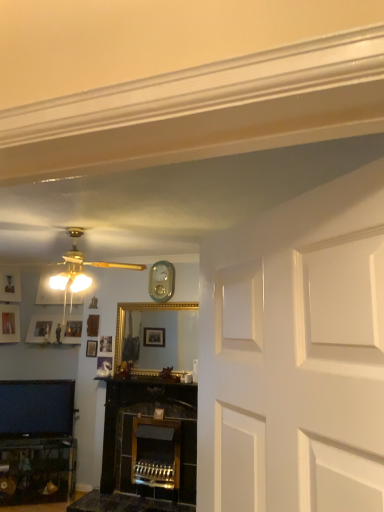
What do you see at coordinates (71, 279) in the screenshot? This screenshot has width=384, height=512. I see `matte gold ceiling fan at upper left` at bounding box center [71, 279].

Locate an element on the screen. teal glossy clock at upper center is located at coordinates (162, 281).

At what (x,y) coordinates should I click in order to perform the action: click on matte black tv at lower left. Please return your answer as a coordinate pair (x, y). Looking at the image, I should click on (36, 408).

You are a GUI agent. You are given a task and a screenshot of the screen. Output one action in this format:
    pyautogui.click(x=<x>, y=<y>)
    Task: Click on the matte gold ceiling fan at upper left
    This screenshot has height=512, width=384.
    Given the screenshot: What is the action you would take?
    pyautogui.click(x=71, y=279)

Is matte silver picture frame at upper left, which ranks as the 1th picture frame in back-to-front order, smaller than teal glossy clock at upper center?

Incorrect, matte silver picture frame at upper left, which ranks as the 1th picture frame in back-to-front order, is not smaller in size than teal glossy clock at upper center.

You are a GUI agent. You are given a task and a screenshot of the screen. Output one action in this format:
    pyautogui.click(x=<x>, y=<y>)
    Task: Click on the 2nd picture frame directly beneath the teal glossy clock at upper center (from a real-world perspective)
    This screenshot has height=512, width=384.
    Given the screenshot: What is the action you would take?
    point(40,329)

From a real-world perspective, is matte silver picture frame at upper left, which ranks as the 1th picture frame in back-to-front order, located higher than teal glossy clock at upper center?

Incorrect, from a real-world perspective, matte silver picture frame at upper left, which ranks as the 1th picture frame in back-to-front order, is lower than teal glossy clock at upper center.

The image size is (384, 512). What are the coordinates of `picture frame that is the 2nd object to the left of the matte gold ceiling fan at upper left, starting at the anchor` in the screenshot? It's located at (40, 329).

From a real-world perspective, is matte silver picture frame at upper left, acting as the second picture frame starting from the left, positioned over matte gold ceiling fan at upper left based on gravity?

Actually, matte silver picture frame at upper left, acting as the second picture frame starting from the left, is physically below matte gold ceiling fan at upper left in the real world.

Does matte silver picture frame at upper left, acting as the 2th picture frame starting from the right, have a lesser width compared to matte gold ceiling fan at upper left?

Indeed, matte silver picture frame at upper left, acting as the 2th picture frame starting from the right, has a lesser width compared to matte gold ceiling fan at upper left.

Consider the image. Between matte silver picture frame at upper left, acting as the 2th picture frame starting from the right, and matte gold ceiling fan at upper left, which one is positioned in front?

matte gold ceiling fan at upper left is in front.

Is matte silver picture frame at left, placed as the 1th picture frame when sorted from left to right, at the back of matte silver picture frame at upper left, acting as the 2th picture frame starting from the right?

matte silver picture frame at upper left, acting as the 2th picture frame starting from the right, is not turned away from matte silver picture frame at left, placed as the 1th picture frame when sorted from left to right.

How different are the orientations of matte silver picture frame at upper left, which ranks as the 1th picture frame in back-to-front order, and matte silver picture frame at left, arranged as the second picture frame when viewed from the back, in degrees?

The angular difference between matte silver picture frame at upper left, which ranks as the 1th picture frame in back-to-front order, and matte silver picture frame at left, arranged as the second picture frame when viewed from the back, is 89.6 degrees.

In the image, is matte silver picture frame at upper left, the third picture frame from the front, positioned in front of or behind matte silver picture frame at left, the 3th picture frame positioned from the right?

matte silver picture frame at upper left, the third picture frame from the front, is positioned farther from the viewer than matte silver picture frame at left, the 3th picture frame positioned from the right.

Is teal glossy clock at upper center further to the viewer compared to matte black tv at lower left?

Yes, it is.

Locate an element on the screen. The height and width of the screenshot is (512, 384). clock above the matte black tv at lower left (from a real-world perspective) is located at coordinates (162, 281).

Is teal glossy clock at upper center thinner than matte black tv at lower left?

Indeed, teal glossy clock at upper center has a lesser width compared to matte black tv at lower left.

Which is in front, point (90, 283) or point (43, 390)?

The point (90, 283) is more forward.

Is matte gold ceiling fan at upper left to the left or to the right of matte black tv at lower left in the image?

From the image, it's evident that matte gold ceiling fan at upper left is to the right of matte black tv at lower left.

Could you tell me if matte gold ceiling fan at upper left is turned towards matte black tv at lower left?

No, matte gold ceiling fan at upper left is not oriented towards matte black tv at lower left.

Is the surface of matte gold ceiling fan at upper left in direct contact with matte black tv at lower left?

There is a gap between matte gold ceiling fan at upper left and matte black tv at lower left.

Who is shorter, matte black tv at lower left or matte silver picture frame at upper left, acting as the second picture frame starting from the left?

Standing shorter between the two is matte silver picture frame at upper left, acting as the second picture frame starting from the left.

Could matte silver picture frame at upper left, acting as the second picture frame starting from the left, be considered to be inside matte black tv at lower left?

No, matte silver picture frame at upper left, acting as the second picture frame starting from the left, is not a part of matte black tv at lower left.

Considering the relative positions of matte black tv at lower left and matte silver picture frame at upper left, the third picture frame from the front, in the image provided, is matte black tv at lower left to the left of matte silver picture frame at upper left, the third picture frame from the front, from the viewer's perspective?

In fact, matte black tv at lower left is to the right of matte silver picture frame at upper left, the third picture frame from the front.

Which is more to the right, matte silver picture frame at left, the 3th picture frame positioned from the right, or teal glossy clock at upper center?

From the viewer's perspective, teal glossy clock at upper center appears more on the right side.

Could you tell me if matte silver picture frame at left, the 2th picture frame when ordered from front to back, is turned towards teal glossy clock at upper center?

Yes, matte silver picture frame at left, the 2th picture frame when ordered from front to back, is turned towards teal glossy clock at upper center.

Which is closer to the camera, (15, 305) or (166, 263)?

Point (15, 305) is farther from the camera than point (166, 263).

In terms of size, does matte silver picture frame at left, placed as the 1th picture frame when sorted from left to right, appear bigger or smaller than teal glossy clock at upper center?

In the image, matte silver picture frame at left, placed as the 1th picture frame when sorted from left to right, appears to be larger than teal glossy clock at upper center.

Which picture frame is the 3rd one when counting from the back of the teal glossy clock at upper center? Please provide its 2D coordinates.

[(40, 329)]

What are the coordinates of `lamp positioned vertically above the matte silver picture frame at upper left, acting as the second picture frame starting from the left (from a real-world perspective)` in the screenshot? It's located at (71, 279).

Considering their positions, is matte silver picture frame at left, placed as the 1th picture frame when sorted from left to right, positioned closer to matte black tv at lower left than teal glossy clock at upper center?

matte silver picture frame at left, placed as the 1th picture frame when sorted from left to right, is positioned closer to the anchor matte black tv at lower left.

Looking at the image, which one is located closer to matte silver picture frame at upper left, acting as the second picture frame starting from the left, wooden picture frame at upper left, the first picture frame viewed from the front, or teal glossy clock at upper center?

The object closer to matte silver picture frame at upper left, acting as the second picture frame starting from the left, is wooden picture frame at upper left, the first picture frame viewed from the front.

Looking at the image, which one is located further to teal glossy clock at upper center, matte gold ceiling fan at upper left or matte silver picture frame at left, arranged as the second picture frame when viewed from the back?

matte silver picture frame at left, arranged as the second picture frame when viewed from the back.

Looking at the image, which one is located further to matte black tv at lower left, matte silver picture frame at upper left, the third picture frame from the front, or teal glossy clock at upper center?

Among the two, teal glossy clock at upper center is located further to matte black tv at lower left.

Estimate the real-world distances between objects in this image. Which object is closer to teal glossy clock at upper center, matte gold ceiling fan at upper left or wooden picture frame at upper left, which appears as the first picture frame when viewed from the right?

wooden picture frame at upper left, which appears as the first picture frame when viewed from the right, is positioned closer to the anchor teal glossy clock at upper center.

When comparing their distances from matte gold ceiling fan at upper left, does matte black tv at lower left or wooden picture frame at upper left, the 3th picture frame viewed from the back, seem further?

matte black tv at lower left is further to matte gold ceiling fan at upper left.

Which object lies nearer to the anchor point matte silver picture frame at upper left, acting as the second picture frame starting from the left, matte silver picture frame at left, the 3th picture frame positioned from the right, or matte gold ceiling fan at upper left?

Based on the image, matte silver picture frame at left, the 3th picture frame positioned from the right, appears to be nearer to matte silver picture frame at upper left, acting as the second picture frame starting from the left.

When comparing their distances from matte silver picture frame at upper left, which ranks as the 1th picture frame in back-to-front order, does matte black tv at lower left or teal glossy clock at upper center seem closer?

matte black tv at lower left is closer to matte silver picture frame at upper left, which ranks as the 1th picture frame in back-to-front order.

Where is `picture frame between matte gold ceiling fan at upper left and matte silver picture frame at left, arranged as the second picture frame when viewed from the back, from front to back`? This screenshot has width=384, height=512. picture frame between matte gold ceiling fan at upper left and matte silver picture frame at left, arranged as the second picture frame when viewed from the back, from front to back is located at coordinates (91, 348).

Where is `television between matte silver picture frame at upper left, acting as the second picture frame starting from the left, and teal glossy clock at upper center from left to right`? Image resolution: width=384 pixels, height=512 pixels. television between matte silver picture frame at upper left, acting as the second picture frame starting from the left, and teal glossy clock at upper center from left to right is located at coordinates (36, 408).

The width and height of the screenshot is (384, 512). What are the coordinates of `television between matte silver picture frame at left, the 2th picture frame when ordered from front to back, and teal glossy clock at upper center, in the horizontal direction` in the screenshot? It's located at (36, 408).

What are the coordinates of `clock between matte gold ceiling fan at upper left and matte black tv at lower left in the up-down direction` in the screenshot? It's located at (162, 281).